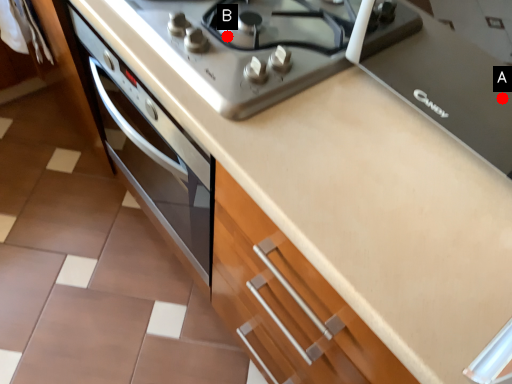
Question: Two points are circled on the image, labeled by A and B beside each circle. Among these points, which one is nearest to the camera?

Choices:
 (A) A is closer
 (B) B is closer

Answer: (A)